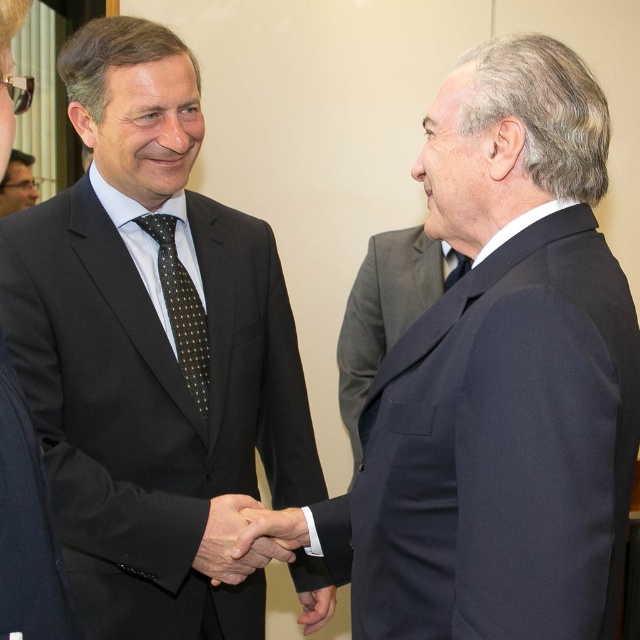
Question: Estimate the real-world distances between objects in this image. Which object is farther from the matte black suit at center?

Choices:
 (A) matte black suit at upper left
 (B) black dotted tie at center

Answer: (A)

Question: Can you confirm if matte black suit at center is positioned above matte black tie at center?

Choices:
 (A) no
 (B) yes

Answer: (A)

Question: Which point is farther to the camera?

Choices:
 (A) matte black suit at upper left
 (B) black dotted tie at center
 (C) matte black suit at center
 (D) matte black tie at center

Answer: (A)

Question: Does matte black suit at upper left have a larger size compared to matte black tie at center?

Choices:
 (A) no
 (B) yes

Answer: (B)

Question: Which point appears farthest from the camera in this image?

Choices:
 (A) (186, 380)
 (B) (22, 172)
 (C) (129, 353)

Answer: (B)

Question: Considering the relative positions of navy wool suit at right and matte black suit at upper left in the image provided, where is navy wool suit at right located with respect to matte black suit at upper left?

Choices:
 (A) above
 (B) below

Answer: (B)